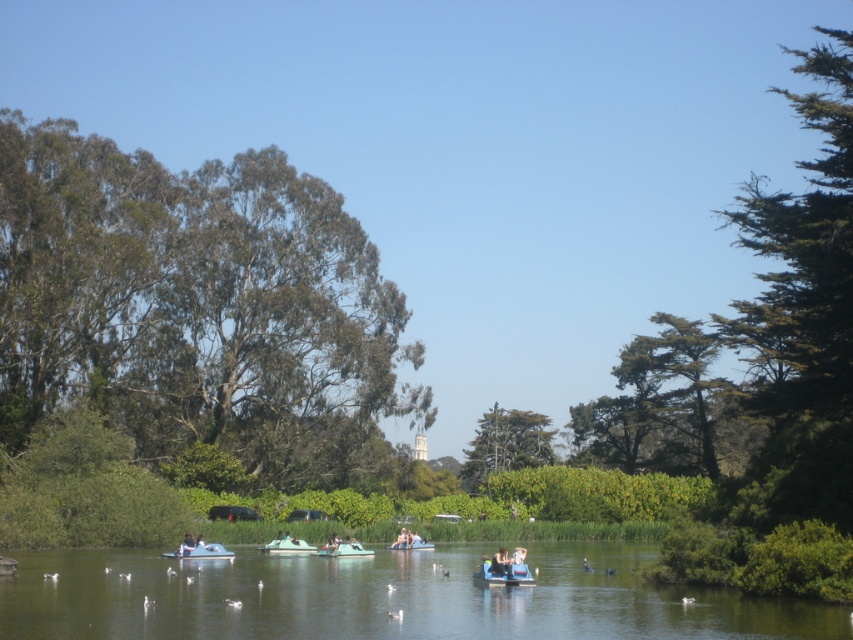
You are a visitor at the park and want to take a photo of the boats on the water. You notice the light blue plastic boat at center and the matte blue paddleboat at center. Which boat is directly above the other?

The light blue plastic boat at center is positioned over matte blue paddleboat at center, meaning it is directly above the other.

You are standing at the center of the park and want to locate the green leafy tree at upper left. According to the coordinates provided, in which direction should you look to find it?

The green leafy tree at upper left is located at coordinates point (196, 308), which is in the upper left direction from your current position at the center of the park.